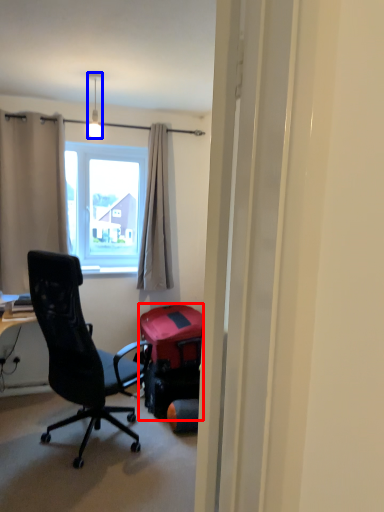
Question: Which object appears closest to the camera in this image, luggage and bags (highlighted by a red box) or lamp (highlighted by a blue box)?

Choices:
 (A) luggage and bags
 (B) lamp

Answer: (B)